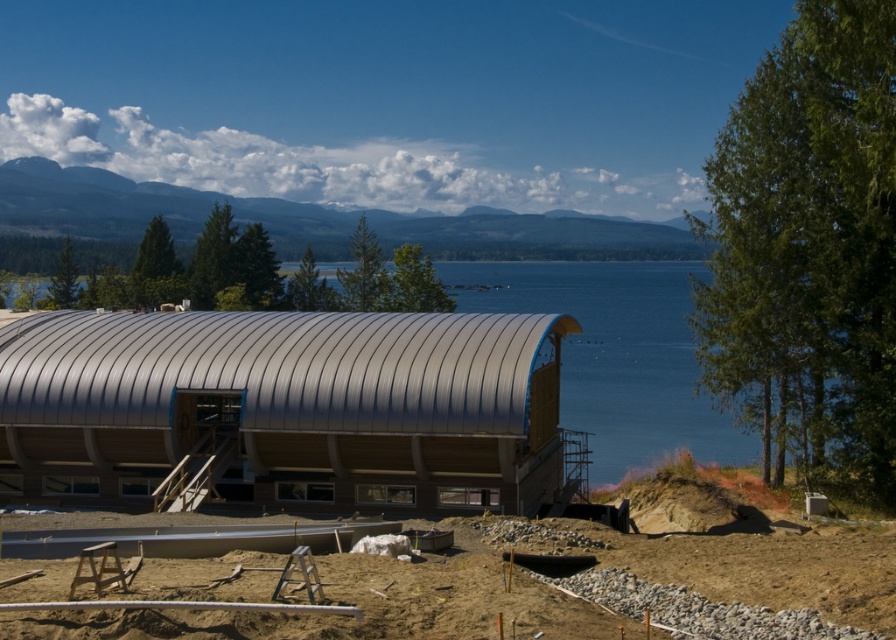
Question: Does metallic silver hut at center appear on the left side of sandy dirt at lower center?

Choices:
 (A) no
 (B) yes

Answer: (B)

Question: Which point is closer to the camera?

Choices:
 (A) pyautogui.click(x=526, y=636)
 (B) pyautogui.click(x=65, y=378)

Answer: (A)

Question: Considering the relative positions of metallic silver hut at center and sandy dirt at lower center in the image provided, where is metallic silver hut at center located with respect to sandy dirt at lower center?

Choices:
 (A) right
 (B) left

Answer: (B)

Question: Which of the following is the farthest from the observer?

Choices:
 (A) (883, 612)
 (B) (365, 452)

Answer: (B)

Question: Does metallic silver hut at center appear on the right side of sandy dirt at lower center?

Choices:
 (A) no
 (B) yes

Answer: (A)